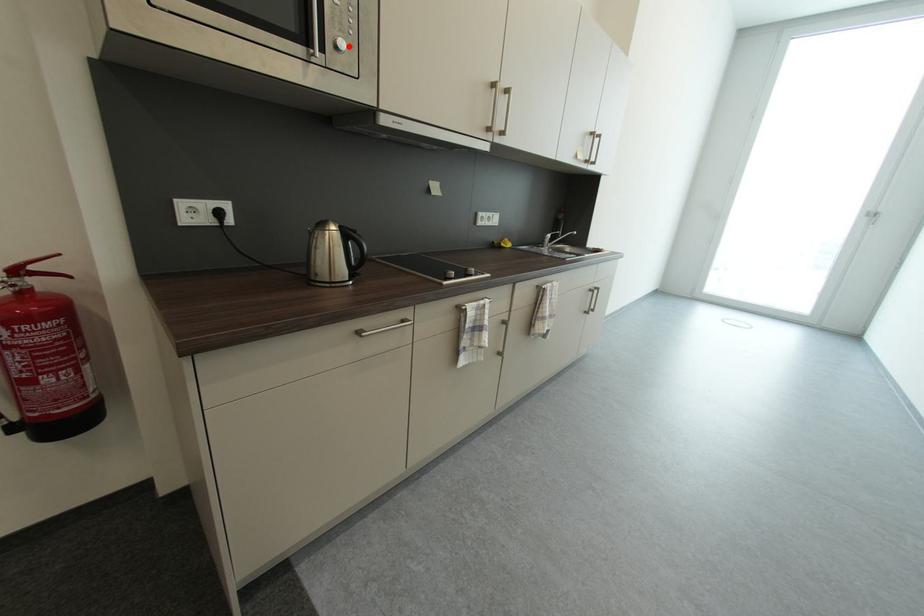
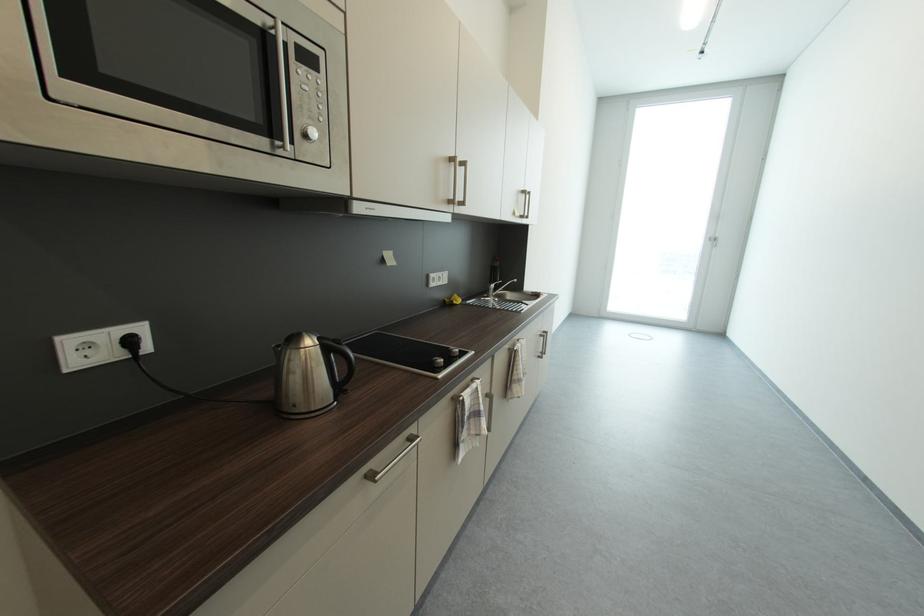
Find the pixel in the second image that matches the highlighted location in the first image.

(321, 134)